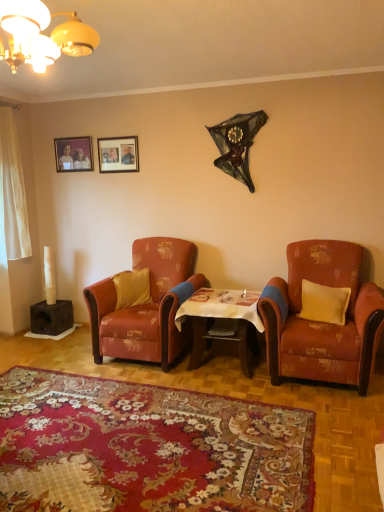
Question: Which direction should I rotate to look at matte wooden picture frame at upper center, which is the 1th picture frame in right-to-left order?

Choices:
 (A) left
 (B) right

Answer: (A)

Question: Is metallic yellow chandelier at upper left beside yellow fabric pillow at center, which is the first pillow in left-to-right order?

Choices:
 (A) no
 (B) yes

Answer: (A)

Question: Is yellow fabric pillow at center, which is the first pillow in left-to-right order, a part of metallic yellow chandelier at upper left?

Choices:
 (A) yes
 (B) no

Answer: (B)

Question: From a real-world perspective, is metallic yellow chandelier at upper left on yellow fabric pillow at center, which is the first pillow in left-to-right order?

Choices:
 (A) no
 (B) yes

Answer: (B)

Question: Is metallic yellow chandelier at upper left positioned before yellow fabric pillow at center, the second pillow when ordered from front to back?

Choices:
 (A) yes
 (B) no

Answer: (A)

Question: Considering the relative positions of metallic yellow chandelier at upper left and yellow fabric pillow at center, the second pillow when ordered from front to back, in the image provided, is metallic yellow chandelier at upper left behind yellow fabric pillow at center, the second pillow when ordered from front to back,?

Choices:
 (A) no
 (B) yes

Answer: (A)

Question: Considering the relative sizes of metallic yellow chandelier at upper left and yellow fabric pillow at center, the second pillow when ordered from right to left, in the image provided, is metallic yellow chandelier at upper left smaller than yellow fabric pillow at center, the second pillow when ordered from right to left,?

Choices:
 (A) no
 (B) yes

Answer: (A)

Question: Considering the relative positions of floral carpet at center and distressed orange fabric armchair at right, arranged as the second chair when viewed from the left, in the image provided, is floral carpet at center to the left of distressed orange fabric armchair at right, arranged as the second chair when viewed from the left, from the viewer's perspective?

Choices:
 (A) yes
 (B) no

Answer: (A)

Question: Is floral carpet at center oriented towards distressed orange fabric armchair at right, the first chair from the right?

Choices:
 (A) yes
 (B) no

Answer: (B)

Question: From the image's perspective, does floral carpet at center appear lower than distressed orange fabric armchair at right, the first chair from the right?

Choices:
 (A) no
 (B) yes

Answer: (B)

Question: Is floral carpet at center smaller than distressed orange fabric armchair at right, the first chair from the right?

Choices:
 (A) no
 (B) yes

Answer: (B)

Question: Is there a large distance between floral carpet at center and distressed orange fabric armchair at right, the first chair from the right?

Choices:
 (A) no
 (B) yes

Answer: (B)

Question: Is floral carpet at center taller than distressed orange fabric armchair at right, arranged as the second chair when viewed from the left?

Choices:
 (A) yes
 (B) no

Answer: (B)

Question: Is the position of matte wooden picture frame at upper center, acting as the second picture frame starting from the left, less distant than that of wooden table at center?

Choices:
 (A) no
 (B) yes

Answer: (A)